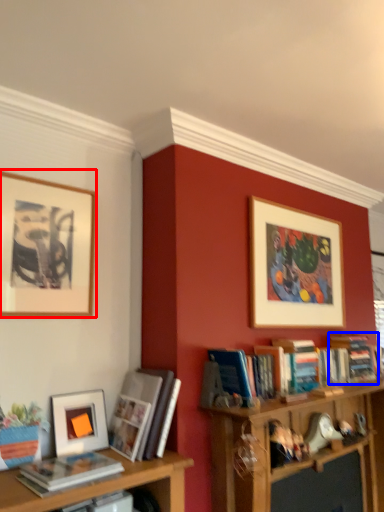
Question: Which object appears closest to the camera in this image, picture frame (highlighted by a red box) or book (highlighted by a blue box)?

Choices:
 (A) picture frame
 (B) book

Answer: (A)